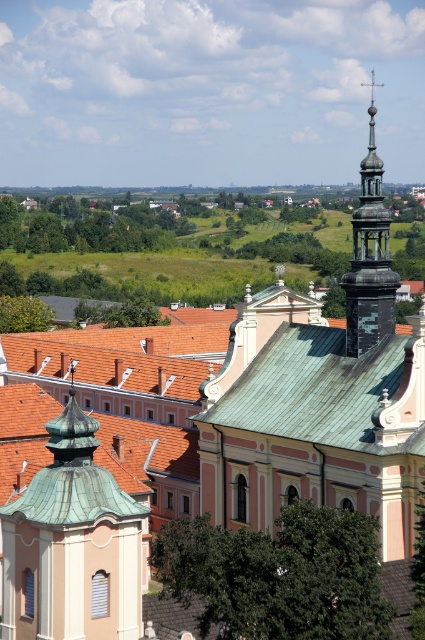
You are an architect analyzing the historic town. You need to determine which of the two copper structures, the green copper dome at center or the shiny copper spire at upper right, has a larger diameter at the base. Based on the scene description, which one is wider?

The shiny copper spire at upper right is wider than the green copper dome at center because the description states that the green copper dome at center is thinner than the shiny copper spire at upper right.

You are an architect designing a new building that needs to align with the historic town layout. The town requires that the new building must be placed at coordinates between 0.8 and 0.9 on the x and y axes. Is the green copper dome at center within the required coordinates?

The green copper dome at center is located at coordinates (71,545). Since the town requires placement between 0.8 and 0.9 on both axes, the x coordinate is within range, but the y coordinate is below 0.8. Therefore, the green copper dome at center does not meet the town requirements.

You are a tourist standing in front of the historic building and want to take a photo that includes both the green copper dome at center and the shiny copper spire at upper right. Based on their positions, which one should you pan your camera towards first to ensure both are in frame?

The green copper dome at center is positioned on the left side of the shiny copper spire at upper right, so you should pan your camera towards the green copper dome at center first to ensure both are in frame.